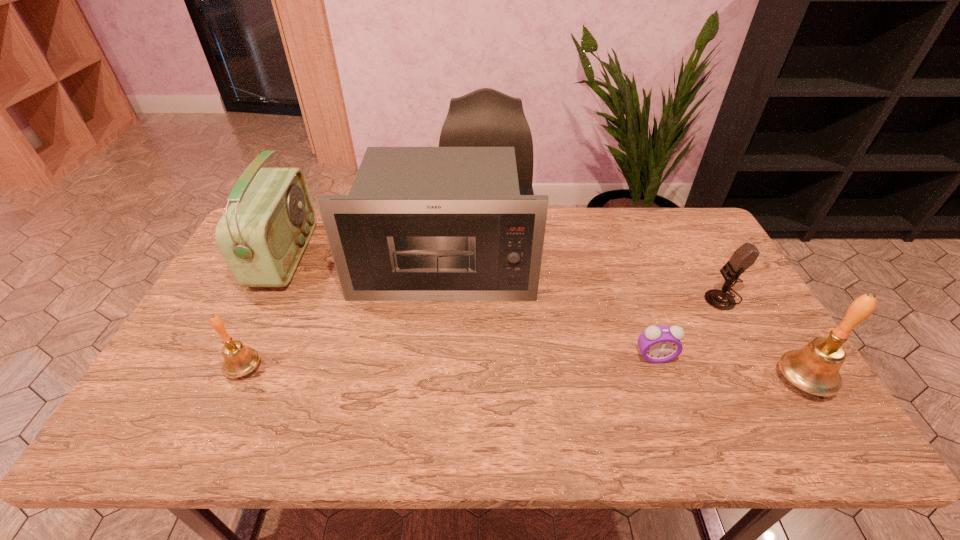
Locate an element on the screen. vacant space located on the front panel of the radio receiver is located at coordinates (417, 256).

This screenshot has height=540, width=960. I want to click on blank space located on the face of the shortest object, so click(664, 384).

Where is `vacant space located 0.110m on the front-facing side of the microphone`? vacant space located 0.110m on the front-facing side of the microphone is located at coordinates 666,297.

In order to click on vacant space positioned 0.130m on the front-facing side of the microphone in this screenshot , I will do `click(660, 297)`.

What are the coordinates of `vacant area situated on the front-facing side of the microphone` in the screenshot? It's located at (666, 297).

Identify the location of microwave oven that is at the far edge. This screenshot has height=540, width=960. (420, 223).

This screenshot has width=960, height=540. I want to click on radio receiver located in the far edge section of the desktop, so click(x=262, y=235).

Identify the location of bell present at the left edge. (238, 361).

Locate an element on the screen. The height and width of the screenshot is (540, 960). radio receiver situated at the left edge is located at coordinates (262, 235).

Where is `bell at the right edge`? This screenshot has height=540, width=960. bell at the right edge is located at coordinates (815, 368).